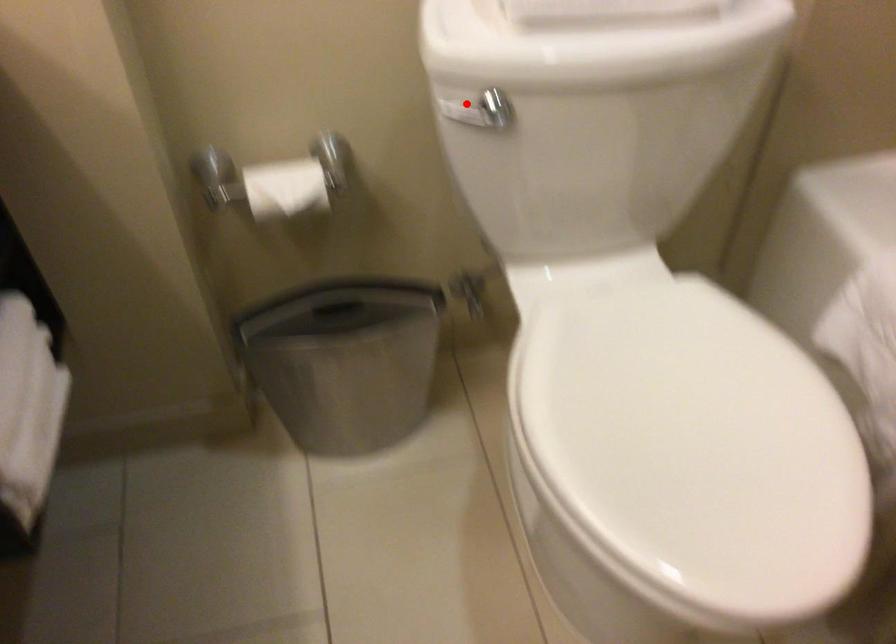
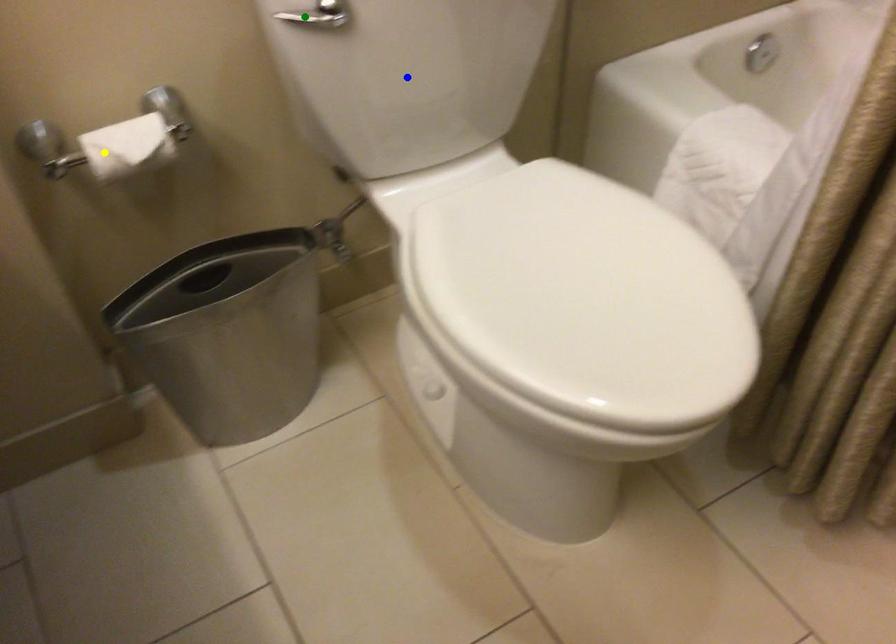
Question: I am providing you with two images of the same scene from different viewpoints. A red point is marked on the first image. You are given multiple points on the second image. Can you choose the point in image 2 that corresponds to the point in image 1?

Choices:
 (A) blue point
 (B) yellow point
 (C) green point

Answer: (C)